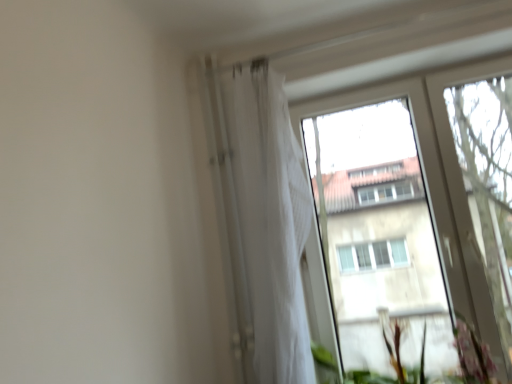
Question: From the image's perspective, is white sheer curtain at upper center positioned above or below transparent glass tree at right?

Choices:
 (A) below
 (B) above

Answer: (A)

Question: Would you say white sheer curtain at upper center is to the left or to the right of transparent glass tree at right in the picture?

Choices:
 (A) left
 (B) right

Answer: (A)

Question: Which object is the closest to the green leafy plant at lower right?

Choices:
 (A) white sheer curtain at upper center
 (B) transparent glass tree at right

Answer: (B)

Question: Which object is positioned farthest from the transparent glass tree at right?

Choices:
 (A) green leafy plant at lower right
 (B) white sheer curtain at upper center

Answer: (B)